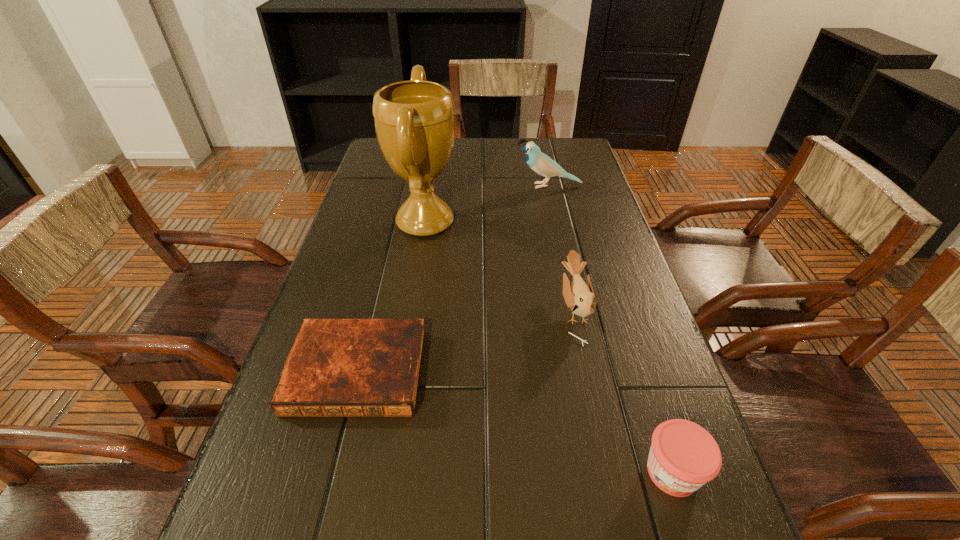
The image size is (960, 540). I want to click on the tallest object, so click(x=414, y=120).

Locate an element on the screen. the farther bird is located at coordinates (543, 165).

Image resolution: width=960 pixels, height=540 pixels. I want to click on the taller bird, so click(543, 165).

I want to click on the shorter bird, so click(x=579, y=297).

The height and width of the screenshot is (540, 960). Find the location of `the nearer bird`. the nearer bird is located at coordinates (579, 297).

Image resolution: width=960 pixels, height=540 pixels. I want to click on the nearest object, so click(683, 456).

Locate an element on the screen. jam is located at coordinates tap(683, 456).

At what (x,y) coordinates should I click in order to perform the action: click on the shortest object. Please return your answer as a coordinate pair (x, y). Looking at the image, I should click on (336, 367).

At what (x,y) coordinates should I click in order to perform the action: click on free location located 0.170m on the front of the tallest object with the decoration. Please return your answer as a coordinate pair (x, y). Image resolution: width=960 pixels, height=540 pixels. Looking at the image, I should click on (520, 222).

At what (x,y) coordinates should I click in order to perform the action: click on free space located 0.050m at the face of the taller bird. Please return your answer as a coordinate pair (x, y). Looking at the image, I should click on (499, 186).